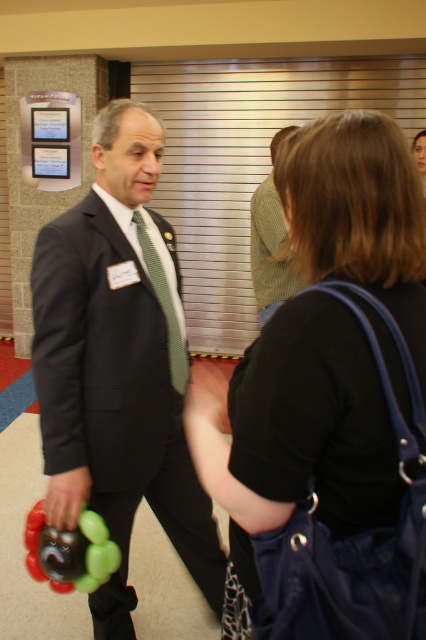
Question: Which object appears farthest from the camera in this image?

Choices:
 (A) green knitted sweater at center
 (B) black fabric purse at center
 (C) green checkered tie at center

Answer: (A)

Question: Considering the relative positions of matte black suit at center and green knitted sweater at center in the image provided, where is matte black suit at center located with respect to green knitted sweater at center?

Choices:
 (A) below
 (B) above

Answer: (A)

Question: Based on their relative distances, which object is nearer to the black fabric purse at center?

Choices:
 (A) green knitted sweater at center
 (B) green checkered tie at center

Answer: (B)

Question: Can you confirm if matte black suit at center is positioned to the right of green knitted sweater at center?

Choices:
 (A) no
 (B) yes

Answer: (A)

Question: Which point is closer to the camera?

Choices:
 (A) (152, 280)
 (B) (353, 561)
 (C) (144, 144)

Answer: (B)

Question: Is the position of matte black suit at center less distant than that of green knitted sweater at center?

Choices:
 (A) yes
 (B) no

Answer: (A)